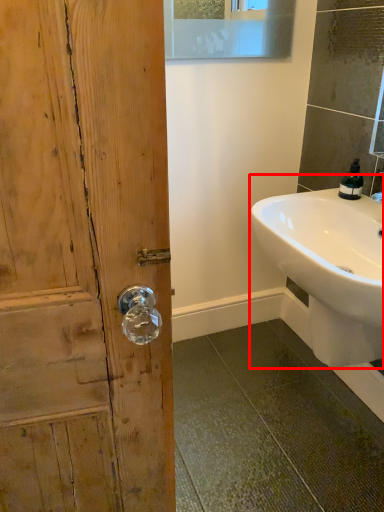
Question: From the image's perspective, considering the relative positions of sink (annotated by the red box) and soap dispenser in the image provided, where is sink (annotated by the red box) located with respect to the staircase?

Choices:
 (A) above
 (B) below

Answer: (B)